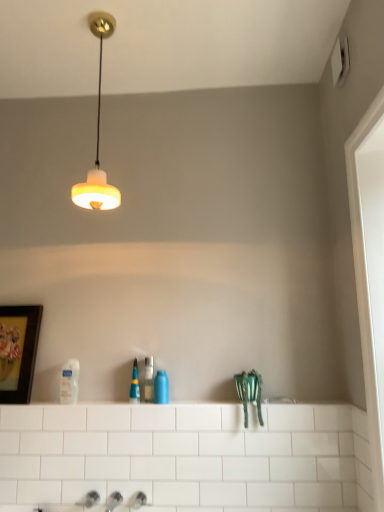
Question: Is wooden framed artwork at left shorter than matte white lampshade at upper center?

Choices:
 (A) no
 (B) yes

Answer: (B)

Question: Could matte white lampshade at upper center be considered to be inside wooden framed artwork at left?

Choices:
 (A) yes
 (B) no

Answer: (B)

Question: Is wooden framed artwork at left in front of matte white lampshade at upper center?

Choices:
 (A) yes
 (B) no

Answer: (B)

Question: Is wooden framed artwork at left directly adjacent to matte white lampshade at upper center?

Choices:
 (A) no
 (B) yes

Answer: (A)

Question: From the image's perspective, is wooden framed artwork at left over matte white lampshade at upper center?

Choices:
 (A) yes
 (B) no

Answer: (B)

Question: Considering the relative positions of white glossy ledge at center and white glossy door at right in the image provided, is white glossy ledge at center to the left or to the right of white glossy door at right?

Choices:
 (A) right
 (B) left

Answer: (B)

Question: Is white glossy ledge at center wider or thinner than white glossy door at right?

Choices:
 (A) thin
 (B) wide

Answer: (B)

Question: Is point (269, 397) positioned closer to the camera than point (357, 206)?

Choices:
 (A) farther
 (B) closer

Answer: (A)

Question: From the image's perspective, relative to white glossy door at right, is white glossy ledge at center above or below?

Choices:
 (A) above
 (B) below

Answer: (B)

Question: Considering their positions, is matte white lampshade at upper center located in front of or behind white glossy ledge at center?

Choices:
 (A) behind
 (B) front

Answer: (B)

Question: From a real-world perspective, is matte white lampshade at upper center positioned above or below white glossy ledge at center?

Choices:
 (A) above
 (B) below

Answer: (A)

Question: From the image's perspective, is matte white lampshade at upper center positioned above or below white glossy ledge at center?

Choices:
 (A) above
 (B) below

Answer: (A)

Question: Is matte white lampshade at upper center bigger or smaller than white glossy ledge at center?

Choices:
 (A) small
 (B) big

Answer: (B)

Question: Considering the positions of blue glossy bottle at center, which is the 1th toiletry in right-to-left order, and white glossy door at right in the image, is blue glossy bottle at center, which is the 1th toiletry in right-to-left order, bigger or smaller than white glossy door at right?

Choices:
 (A) small
 (B) big

Answer: (A)

Question: Does point (167, 388) appear closer or farther from the camera than point (352, 205)?

Choices:
 (A) closer
 (B) farther

Answer: (B)